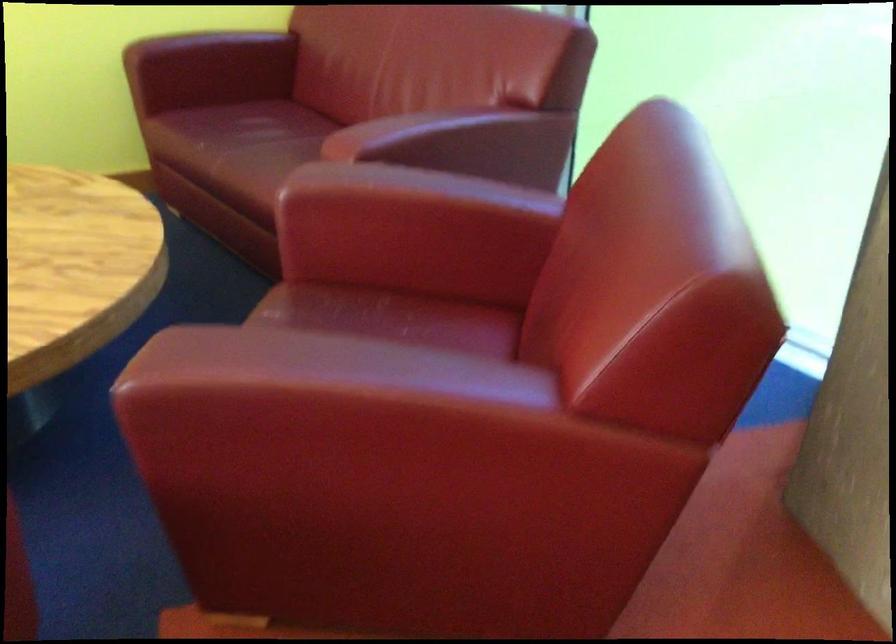
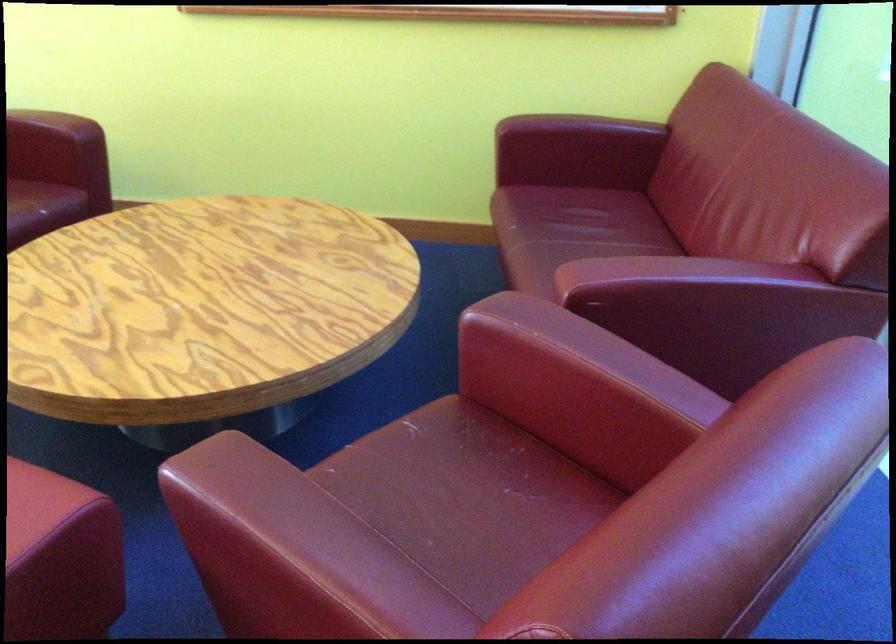
Find the pixel in the second image that matches pixel 515 147 in the first image.

(787, 323)